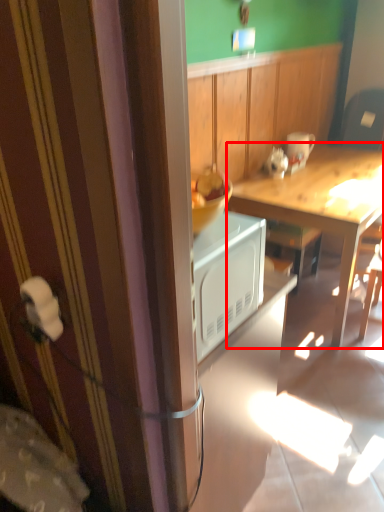
Question: Observing the image, what is the correct spatial positioning of desk (annotated by the red box) in reference to coffee cup?

Choices:
 (A) right
 (B) left

Answer: (A)